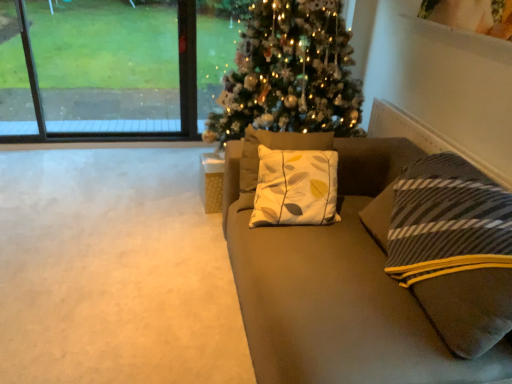
Question: Is transparent glass window at upper left at the back of wooden cube at center?

Choices:
 (A) yes
 (B) no

Answer: (B)

Question: Considering the relative sizes of wooden cube at center and transparent glass window at upper left in the image provided, is wooden cube at center bigger than transparent glass window at upper left?

Choices:
 (A) no
 (B) yes

Answer: (A)

Question: Are wooden cube at center and transparent glass window at upper left far apart?

Choices:
 (A) no
 (B) yes

Answer: (B)

Question: Can you confirm if wooden cube at center is positioned to the left of transparent glass window at upper left?

Choices:
 (A) no
 (B) yes

Answer: (A)

Question: Is wooden cube at center facing towards transparent glass window at upper left?

Choices:
 (A) yes
 (B) no

Answer: (B)

Question: From a real-world perspective, is wooden cube at center on top of transparent glass window at upper left?

Choices:
 (A) yes
 (B) no

Answer: (B)

Question: Can you confirm if transparent glass window at upper left is smaller than suede couch at center?

Choices:
 (A) yes
 (B) no

Answer: (A)

Question: Does transparent glass window at upper left come behind suede couch at center?

Choices:
 (A) no
 (B) yes

Answer: (B)

Question: From a real-world perspective, is transparent glass window at upper left on top of suede couch at center?

Choices:
 (A) no
 (B) yes

Answer: (B)

Question: Is transparent glass window at upper left shorter than suede couch at center?

Choices:
 (A) yes
 (B) no

Answer: (B)

Question: Is transparent glass window at upper left in front of suede couch at center?

Choices:
 (A) yes
 (B) no

Answer: (B)

Question: Can you confirm if transparent glass window at upper left is positioned to the left of suede couch at center?

Choices:
 (A) no
 (B) yes

Answer: (B)

Question: Is suede couch at center positioned with its back to wooden cube at center?

Choices:
 (A) yes
 (B) no

Answer: (B)